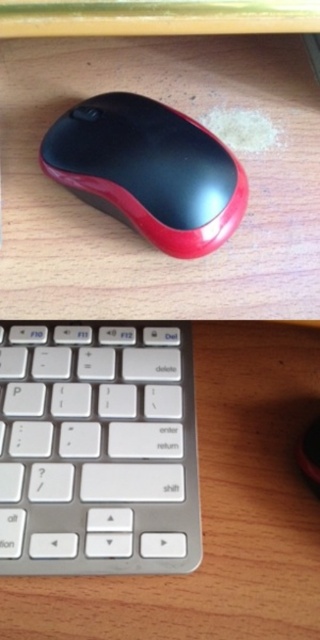
You are setting up a workspace and need to place both the white plastic keyboard at center and the rubberized glossy mouse at center on a desk. If the desk has a width limit, which object might require more space horizontally?

The white plastic keyboard at center is wider than the rubberized glossy mouse at center, so it would require more horizontal space.

What object is located at the coordinates point (97, 449)?

The white plastic keyboard at center is located at point (97, 449).